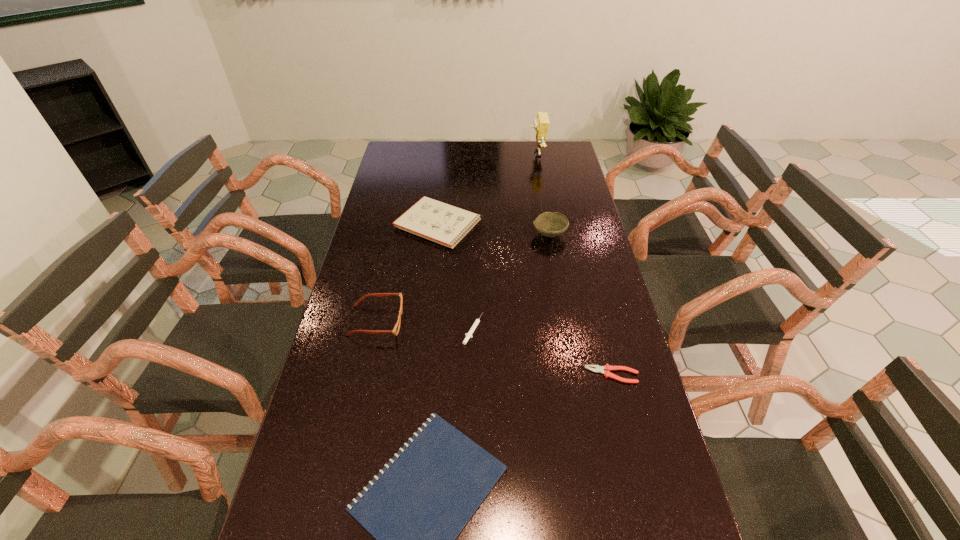
Locate an element on the screen. vacant space situated 0.150m on the face of the farthest object is located at coordinates (495, 154).

This screenshot has height=540, width=960. Identify the location of free space located on the back of the sixth shortest object. (543, 201).

Where is `free space located on the front-facing side of the spectacles`? This screenshot has height=540, width=960. free space located on the front-facing side of the spectacles is located at coordinates (536, 321).

At what (x,y) coordinates should I click in order to perform the action: click on vacant space located on the front of the farther notepad. Please return your answer as a coordinate pair (x, y). The height and width of the screenshot is (540, 960). Looking at the image, I should click on (435, 265).

Locate an element on the screen. The height and width of the screenshot is (540, 960). vacant space located 0.370m on the right of the syringe is located at coordinates (612, 329).

The width and height of the screenshot is (960, 540). I want to click on vacant region located on the back of the sixth farthest object, so (x=601, y=331).

Image resolution: width=960 pixels, height=540 pixels. In order to click on object located in the far edge section of the desktop in this screenshot , I will do `click(541, 124)`.

The image size is (960, 540). In order to click on spectacles that is positioned at the left edge in this screenshot , I will do `click(395, 331)`.

Image resolution: width=960 pixels, height=540 pixels. Identify the location of notepad at the left edge. (445, 224).

This screenshot has width=960, height=540. In order to click on sponge located in the right edge section of the desktop in this screenshot , I will do `click(541, 124)`.